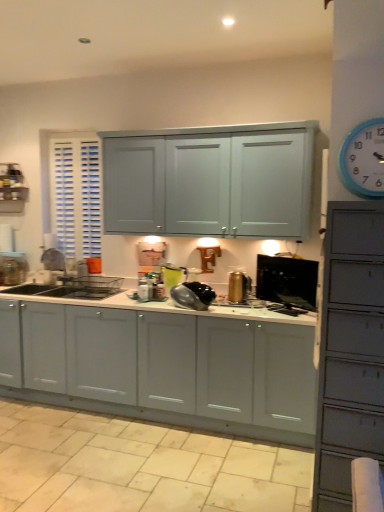
Locate an element on the screen. This screenshot has height=512, width=384. free space to the left of black glossy monitor at center, which is the 1th appliance from right to left is located at coordinates (253, 309).